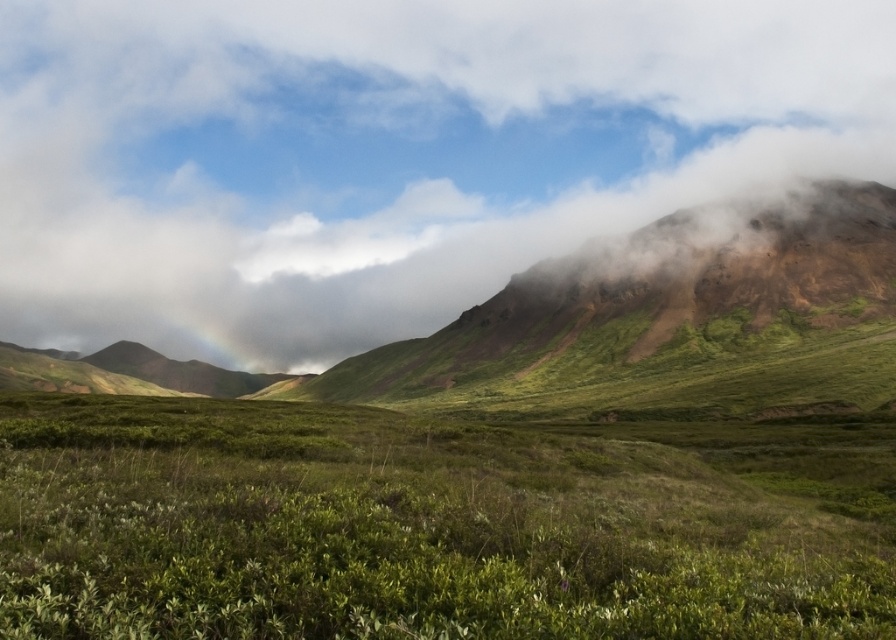
Is white fluffy cloud at upper center shorter than green matte grass at center?

In fact, white fluffy cloud at upper center may be taller than green matte grass at center.

Between white fluffy cloud at upper center and green matte grass at center, which one appears on the right side from the viewer's perspective?

green matte grass at center is more to the right.

Is point (0, 83) positioned before point (340, 496)?

No, (0, 83) is behind (340, 496).

Identify the location of white fluffy cloud at upper center. Image resolution: width=896 pixels, height=640 pixels. (386, 154).